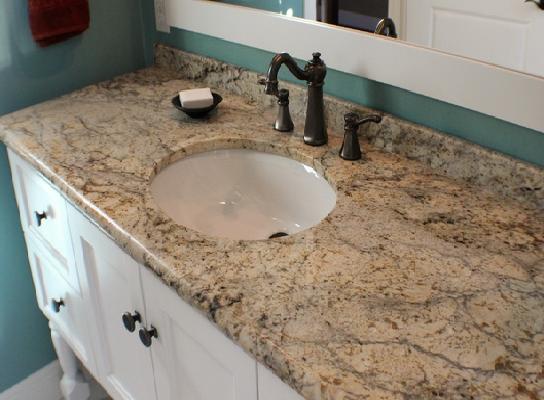
I want to click on soap, so click(200, 96).